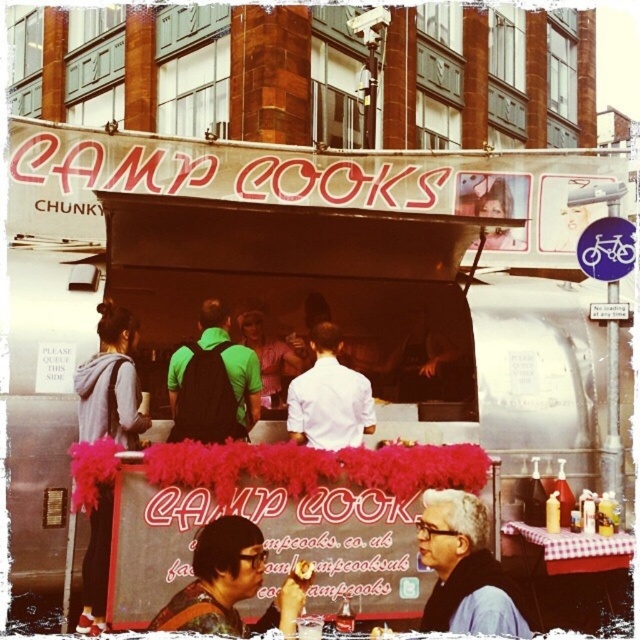
Does gray fabric shirt at center have a greater width compared to matte black shirt at lower center?

Incorrect, gray fabric shirt at center's width does not surpass matte black shirt at lower center's.

Who is lower down, gray fabric shirt at center or matte black shirt at lower center?

Positioned lower is gray fabric shirt at center.

Does point (420, 538) come closer to viewer compared to point (209, 556)?

That is False.

This screenshot has height=640, width=640. Identify the location of gray fabric shirt at center. (x=464, y=568).

Between matte black shirt at lower center and smooth chocolate bar at center, which one is positioned lower?

smooth chocolate bar at center

Which of these two, matte black shirt at lower center or smooth chocolate bar at center, stands shorter?

Standing shorter between the two is smooth chocolate bar at center.

Find the location of a particular element. Image resolution: width=640 pixels, height=640 pixels. matte black shirt at lower center is located at coordinates (228, 584).

In order to click on matte black shirt at lower center in this screenshot , I will do `click(228, 584)`.

Consider the image. Does gray fabric shirt at center have a lesser height compared to smooth chocolate bar at center?

No, gray fabric shirt at center is not shorter than smooth chocolate bar at center.

Which is in front, point (465, 586) or point (296, 566)?

Point (465, 586) is in front.

Between point (509, 604) and point (298, 577), which one is positioned behind?

The point (298, 577) is more distant.

What are the coordinates of `gray fabric shirt at center` in the screenshot? It's located at (464, 568).